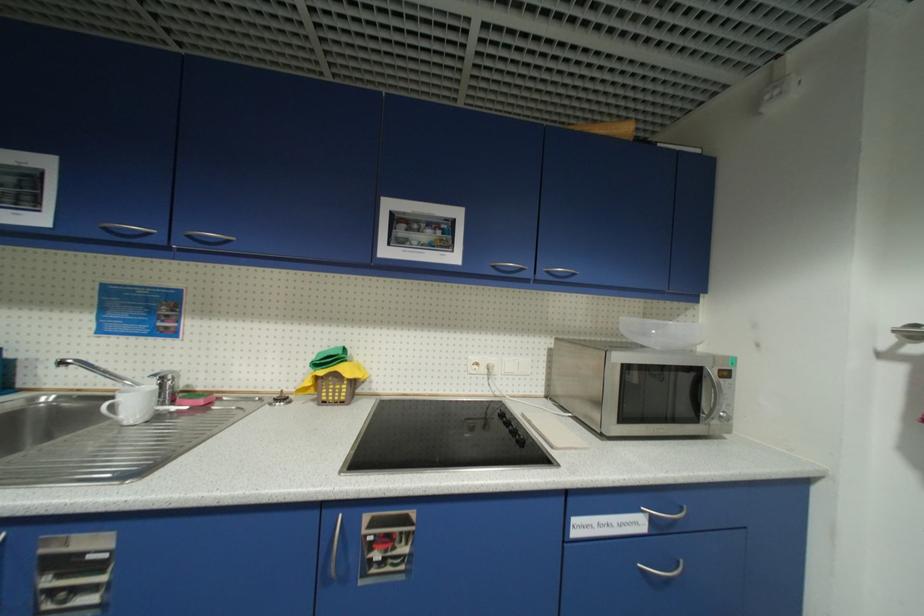
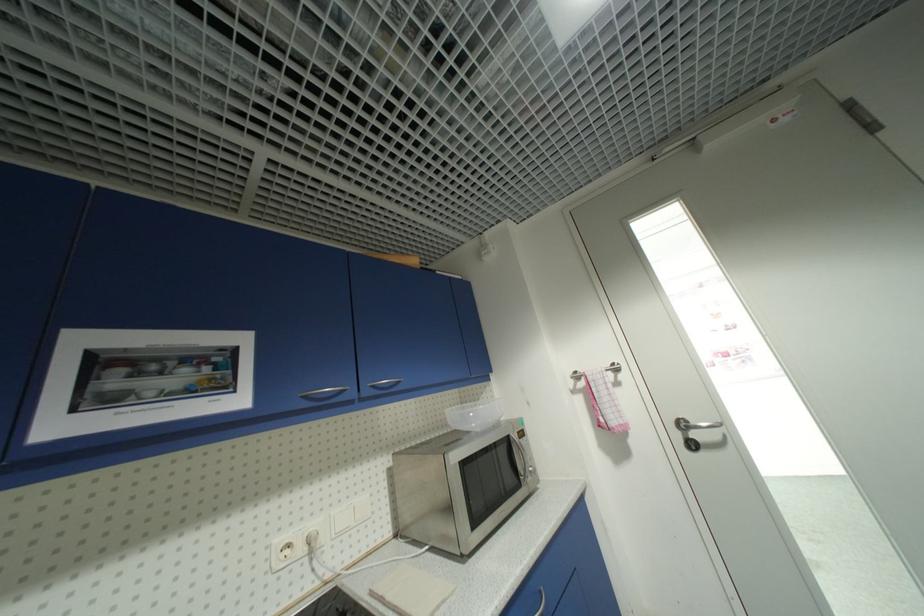
Find the pixel in the second image that matches point (482, 365) in the first image.

(294, 546)